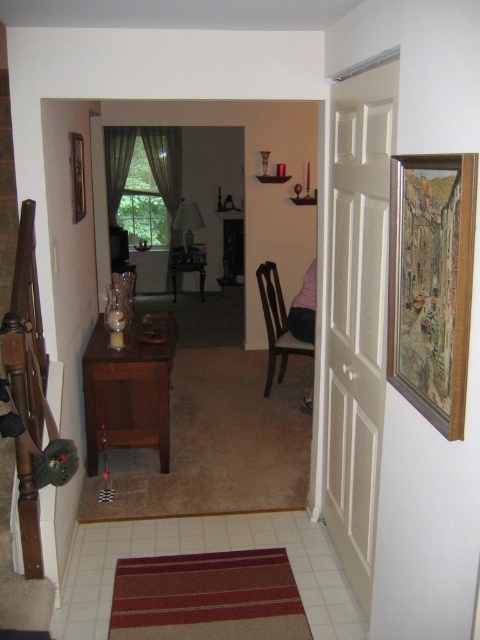
Is matte wood table at center bigger than wooden chair at center?

Yes.

Measure the distance from matte wood table at center to wooden chair at center.

1.14 meters

Which is in front, point (85, 410) or point (259, 285)?

Positioned in front is point (85, 410).

Locate an element on the screen. matte wood table at center is located at coordinates (128, 390).

Which is behind, point (300, 353) or point (204, 262)?

The point (204, 262) is behind.

What do you see at coordinates (286, 317) in the screenshot? This screenshot has width=480, height=640. I see `wooden chair at center` at bounding box center [286, 317].

Locate an element on the screen. The width and height of the screenshot is (480, 640). wooden chair at center is located at coordinates (286, 317).

Find the location of a particular element. The height and width of the screenshot is (640, 480). wooden chair at center is located at coordinates (286, 317).

Can you confirm if matte wood table at center is positioned to the right of wooden table at center?

Yes, matte wood table at center is to the right of wooden table at center.

Describe the element at coordinates (128, 390) in the screenshot. I see `matte wood table at center` at that location.

Does point (142, 436) come behind point (201, 275)?

That is False.

Where is `matte wood table at center`? This screenshot has width=480, height=640. matte wood table at center is located at coordinates (128, 390).